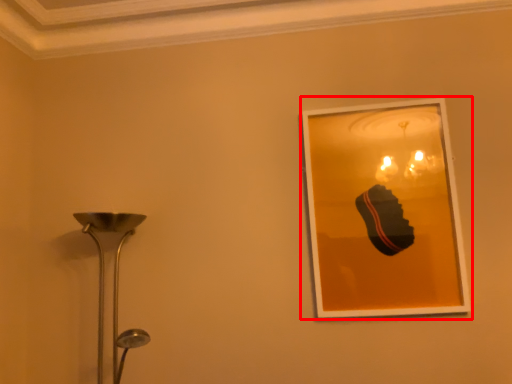
Question: From the image's perspective, what is the correct spatial relationship of picture frame (annotated by the red box) in relation to lamp?

Choices:
 (A) below
 (B) above

Answer: (B)